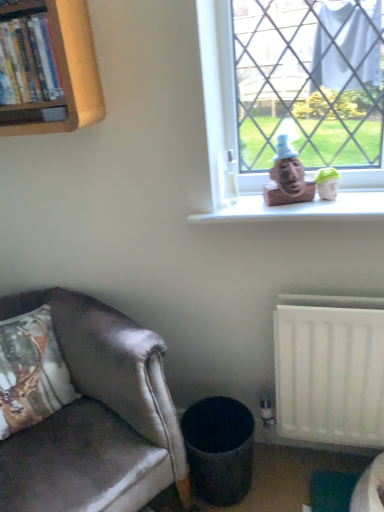
Locate an element on the screen. The height and width of the screenshot is (512, 384). transparent glass coffee cup at upper center is located at coordinates click(x=231, y=178).

Identify the location of green fabric toy at upper right. The height and width of the screenshot is (512, 384). (327, 183).

The width and height of the screenshot is (384, 512). What do you see at coordinates (97, 417) in the screenshot?
I see `satin brown leather chair at lower left` at bounding box center [97, 417].

What are the coordinates of `matte brown bust at window` in the screenshot? It's located at (287, 177).

Is satin brown leather chair at lower left facing away from textured gray trash can at lower center?

satin brown leather chair at lower left is not turned away from textured gray trash can at lower center.

Considering the positions of point (142, 472) and point (231, 423), is point (142, 472) closer or farther from the camera than point (231, 423)?

Point (142, 472).

The width and height of the screenshot is (384, 512). Identify the location of trash bin/can that is under the satin brown leather chair at lower left (from a real-world perspective). (219, 449).

From a real-world perspective, which object stands above the other?

satin brown leather chair at lower left, from a real-world perspective.

How different are the orientations of wooden bookshelf at upper left and matte brown bust at window in degrees?

The angular difference between wooden bookshelf at upper left and matte brown bust at window is 0.445 degrees.

From the picture: Which is nearer, (81, 71) or (283, 180)?

The point (81, 71) is in front.

Are wooden bookshelf at upper left and matte brown bust at window beside each other?

wooden bookshelf at upper left and matte brown bust at window are not in contact.

Can you confirm if wooden bookshelf at upper left is positioned to the right of matte brown bust at window?

No.

Which of these two, textured gray trash can at lower center or green fabric toy at upper right, is smaller?

green fabric toy at upper right.

Considering the sizes of objects textured gray trash can at lower center and green fabric toy at upper right in the image provided, who is thinner, textured gray trash can at lower center or green fabric toy at upper right?

green fabric toy at upper right is thinner.

Which object is positioned more to the left, textured gray trash can at lower center or green fabric toy at upper right?

From the viewer's perspective, textured gray trash can at lower center appears more on the left side.

Who is more distant, textured gray trash can at lower center or green fabric toy at upper right?

Positioned behind is green fabric toy at upper right.

Which point is more distant from viewer, (279, 195) or (66, 420)?

Positioned behind is point (66, 420).

Is matte brown bust at window oriented away from satin brown leather chair at lower left?

No, matte brown bust at window's orientation is not away from satin brown leather chair at lower left.

Looking at their sizes, would you say matte brown bust at window is wider or thinner than satin brown leather chair at lower left?

Clearly, matte brown bust at window has less width compared to satin brown leather chair at lower left.

Is matte brown bust at window at the right side of satin brown leather chair at lower left?

Indeed, matte brown bust at window is positioned on the right side of satin brown leather chair at lower left.

Is matte brown bust at window not within wooden bookshelf at upper left?

matte brown bust at window lies outside wooden bookshelf at upper left's area.

Is matte brown bust at window positioned far away from wooden bookshelf at upper left?

matte brown bust at window is near wooden bookshelf at upper left, not far away.

The width and height of the screenshot is (384, 512). In order to click on person below the wooden bookshelf at upper left (from the image's perspective) in this screenshot , I will do `click(287, 177)`.

Does matte brown bust at window have a greater width compared to wooden bookshelf at upper left?

In fact, matte brown bust at window might be narrower than wooden bookshelf at upper left.

Considering the relative sizes of transparent glass coffee cup at upper center and matte brown bust at window in the image provided, is transparent glass coffee cup at upper center bigger than matte brown bust at window?

Actually, transparent glass coffee cup at upper center might be smaller than matte brown bust at window.

From the image's perspective, is transparent glass coffee cup at upper center located above matte brown bust at window?

Actually, transparent glass coffee cup at upper center appears below matte brown bust at window in the image.

Which is more to the left, transparent glass coffee cup at upper center or matte brown bust at window?

transparent glass coffee cup at upper center.

What are the coordinates of `coffee cup behind the matte brown bust at window` in the screenshot? It's located at (231, 178).

Where is `person in front of the green fabric toy at upper right`? person in front of the green fabric toy at upper right is located at coordinates (287, 177).

Is green fabric toy at upper right behind matte brown bust at window?

Yes.

From the picture: Can you confirm if green fabric toy at upper right is smaller than matte brown bust at window?

Correct, green fabric toy at upper right occupies less space than matte brown bust at window.

Can you tell me how much green fabric toy at upper right and matte brown bust at window differ in facing direction?

1.12 degrees separate the facing orientations of green fabric toy at upper right and matte brown bust at window.

The width and height of the screenshot is (384, 512). Identify the location of chair above the textured gray trash can at lower center (from a real-world perspective). (97, 417).

The height and width of the screenshot is (512, 384). I want to click on person directly beneath the wooden bookshelf at upper left (from a real-world perspective), so click(x=287, y=177).

When comparing their distances from textured gray trash can at lower center, does matte brown bust at window or green fabric toy at upper right seem further?

Based on the image, green fabric toy at upper right appears to be further to textured gray trash can at lower center.

From the picture: When comparing their distances from matte brown bust at window, does textured gray trash can at lower center or green fabric toy at upper right seem further?

Based on the image, textured gray trash can at lower center appears to be further to matte brown bust at window.

Based on the photo, based on their spatial positions, is satin brown leather chair at lower left or wooden bookshelf at upper left further from textured gray trash can at lower center?

Among the two, wooden bookshelf at upper left is located further to textured gray trash can at lower center.

Based on their spatial positions, is satin brown leather chair at lower left or green fabric toy at upper right further from matte brown bust at window?

satin brown leather chair at lower left is further to matte brown bust at window.

From the image, which object appears to be nearer to matte brown bust at window, textured gray trash can at lower center or transparent glass coffee cup at upper center?

transparent glass coffee cup at upper center lies closer to matte brown bust at window than the other object.

From the image, which object appears to be farther from textured gray trash can at lower center, green fabric toy at upper right or matte brown bust at window?

green fabric toy at upper right lies further to textured gray trash can at lower center than the other object.

Considering their positions, is green fabric toy at upper right positioned closer to wooden bookshelf at upper left than textured gray trash can at lower center?

green fabric toy at upper right is closer to wooden bookshelf at upper left.

Which object lies further to the anchor point satin brown leather chair at lower left, textured gray trash can at lower center or wooden bookshelf at upper left?

wooden bookshelf at upper left is further to satin brown leather chair at lower left.

Find the location of a particular element. toy that lies between wooden bookshelf at upper left and textured gray trash can at lower center from top to bottom is located at coordinates (327, 183).

Find the location of a particular element. toy between wooden bookshelf at upper left and satin brown leather chair at lower left in the vertical direction is located at coordinates (327, 183).

Find the location of a particular element. This screenshot has width=384, height=512. coffee cup between wooden bookshelf at upper left and textured gray trash can at lower center vertically is located at coordinates (231, 178).

You are a GUI agent. You are given a task and a screenshot of the screen. Output one action in this format:
    pyautogui.click(x=<x>, y=<y>)
    Task: Click on the person between wooden bookshelf at upper left and textured gray trash can at lower center in the up-down direction
    The width and height of the screenshot is (384, 512).
    Given the screenshot: What is the action you would take?
    pyautogui.click(x=287, y=177)